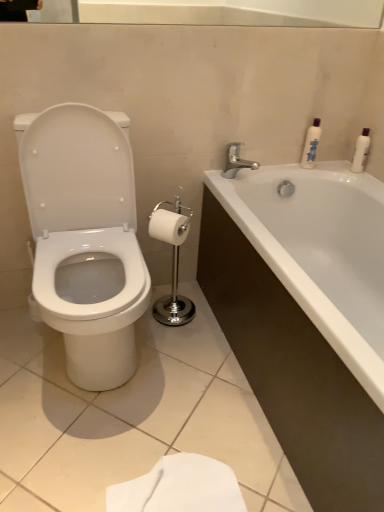
Question: From the image's perspective, is white glossy toilet at left positioned above or below white plastic bottle at upper right, which appears as the second toiletry when viewed from the left?

Choices:
 (A) below
 (B) above

Answer: (A)

Question: From a real-world perspective, relative to white plastic bottle at upper right, which appears as the second toiletry when viewed from the left, is white glossy toilet at left vertically above or below?

Choices:
 (A) above
 (B) below

Answer: (B)

Question: Which of these objects is positioned closest to the white glossy toilet at left?

Choices:
 (A) white glossy bathtub at right
 (B) white glossy lotion at upper right, which is the second toiletry in right-to-left order
 (C) white plastic bottle at upper right, which appears as the second toiletry when viewed from the left
 (D) white matte toilet paper at center
 (E) silver metallic faucet at upper right

Answer: (D)

Question: Estimate the real-world distances between objects in this image. Which object is closer to the white plastic bottle at upper right, which ranks as the 1th toiletry in right-to-left order?

Choices:
 (A) white glossy bathtub at right
 (B) white glossy toilet at left
 (C) white glossy lotion at upper right, the first toiletry positioned from the left
 (D) white matte toilet paper at center
 (E) silver metallic faucet at upper right

Answer: (C)